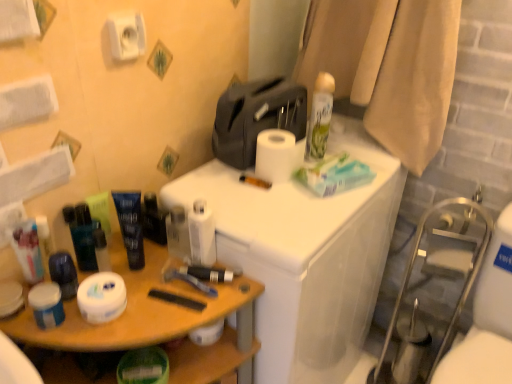
Locate an element on the screen. The image size is (512, 384). spots to the right of white matte toilet paper at lower left, which is counted as the fourth toilet paper, starting from the right is located at coordinates [x=169, y=308].